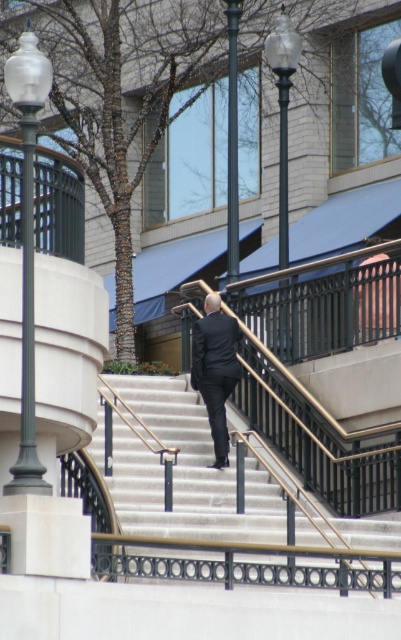
Is smooth concrete stairs at center thinner than polished brass handrail at center?

No, smooth concrete stairs at center is not thinner than polished brass handrail at center.

The width and height of the screenshot is (401, 640). What do you see at coordinates (214, 502) in the screenshot?
I see `smooth concrete stairs at center` at bounding box center [214, 502].

Which is behind, point (101, 557) or point (354, 300)?

The point (354, 300) is behind.

Find the location of a particular element. This screenshot has height=640, width=401. smooth concrete stairs at center is located at coordinates (214, 502).

Does polished brass handrail at center appear over dark suit at center?

Correct, polished brass handrail at center is located above dark suit at center.

Is polished brass handrail at center to the left of dark suit at center from the viewer's perspective?

No, polished brass handrail at center is not to the left of dark suit at center.

You are a GUI agent. You are given a task and a screenshot of the screen. Output one action in this format:
    pyautogui.click(x=<x>, y=<y>)
    Task: Click on the polished brass handrail at center
    
    Given the screenshot: What is the action you would take?
    pyautogui.click(x=311, y=356)

Find the location of a particular element. polished brass handrail at center is located at coordinates (311, 356).

Is smooth concrete stairs at center smaller than dark suit at center?

No.

The height and width of the screenshot is (640, 401). What do you see at coordinates (214, 502) in the screenshot?
I see `smooth concrete stairs at center` at bounding box center [214, 502].

Find the location of a particular element. smooth concrete stairs at center is located at coordinates (214, 502).